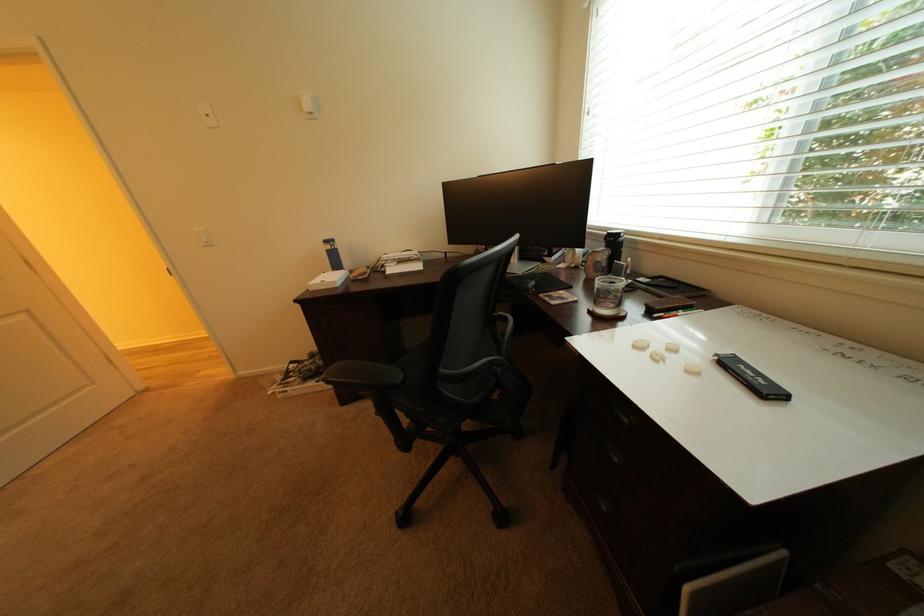
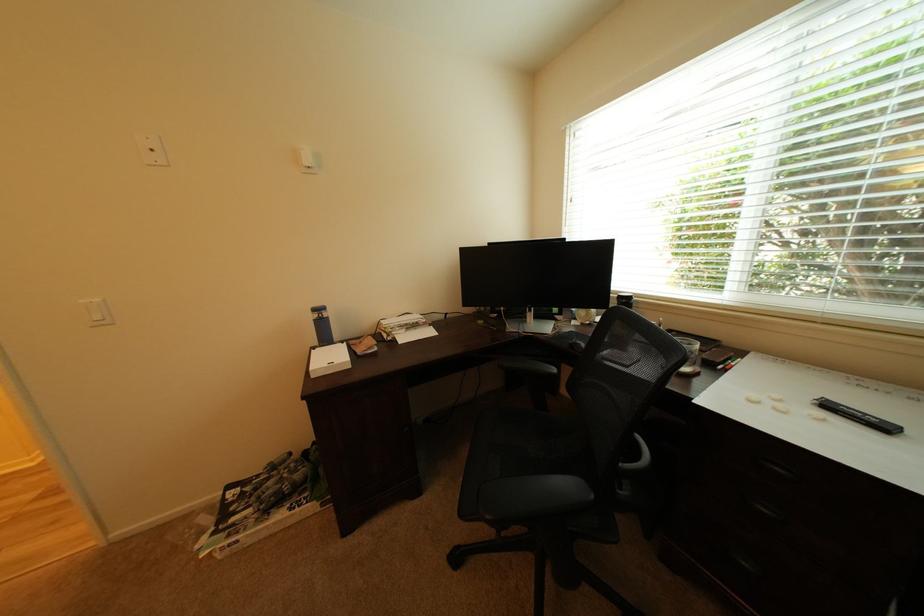
In the second image, find the point that corresponds to the point at 217,118 in the first image.

(163, 152)